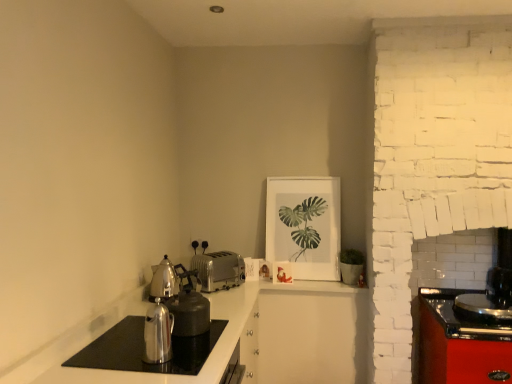
Question: Based on their sizes in the image, would you say satin silver teapot at left is bigger or smaller than polished silver kettle at lower left?

Choices:
 (A) small
 (B) big

Answer: (B)

Question: Is satin silver teapot at left spatially inside polished silver kettle at lower left, or outside of it?

Choices:
 (A) outside
 (B) inside

Answer: (A)

Question: Which of these objects is positioned farthest from the matte white picture frame at upper center?

Choices:
 (A) satin silver teapot at left
 (B) silver metallic toaster at center
 (C) shiny metallic kettle at lower left
 (D) polished silver kettle at lower left

Answer: (C)

Question: Based on their relative distances, which object is nearer to the polished silver kettle at lower left?

Choices:
 (A) shiny metallic kettle at lower left
 (B) matte white picture frame at upper center
 (C) satin silver teapot at left
 (D) silver metallic toaster at center

Answer: (A)